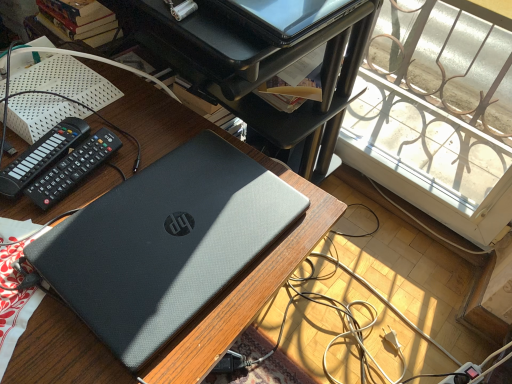
This screenshot has height=384, width=512. What are the coordinates of `free location in front of black plastic remote at upper left, which is counted as the 1th control, starting from the right` in the screenshot? It's located at tap(44, 272).